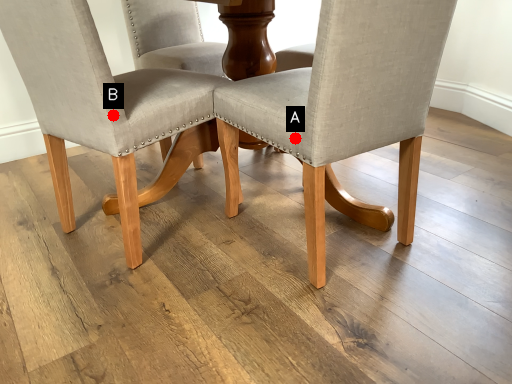
Question: Two points are circled on the image, labeled by A and B beside each circle. Which point is closer to the camera?

Choices:
 (A) A is closer
 (B) B is closer

Answer: (A)